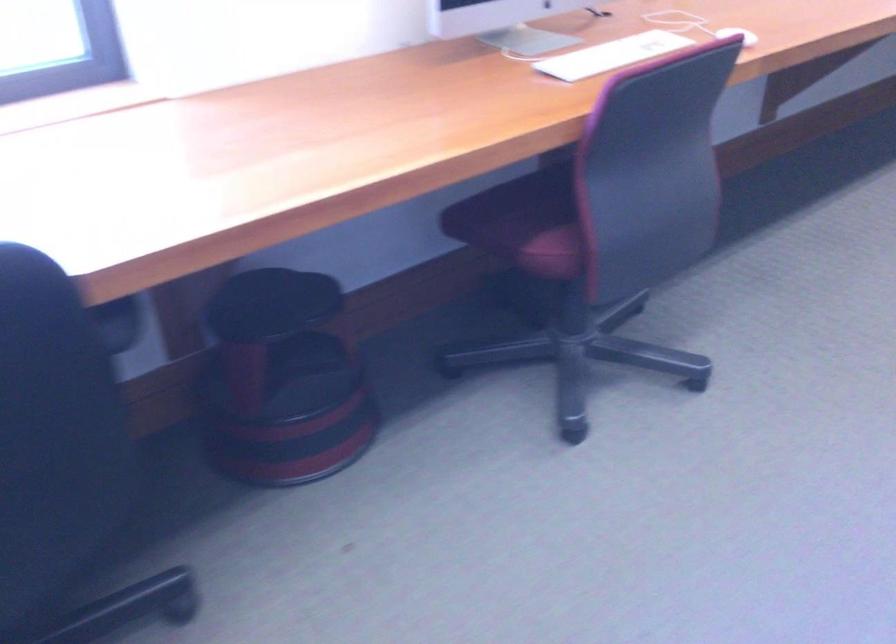
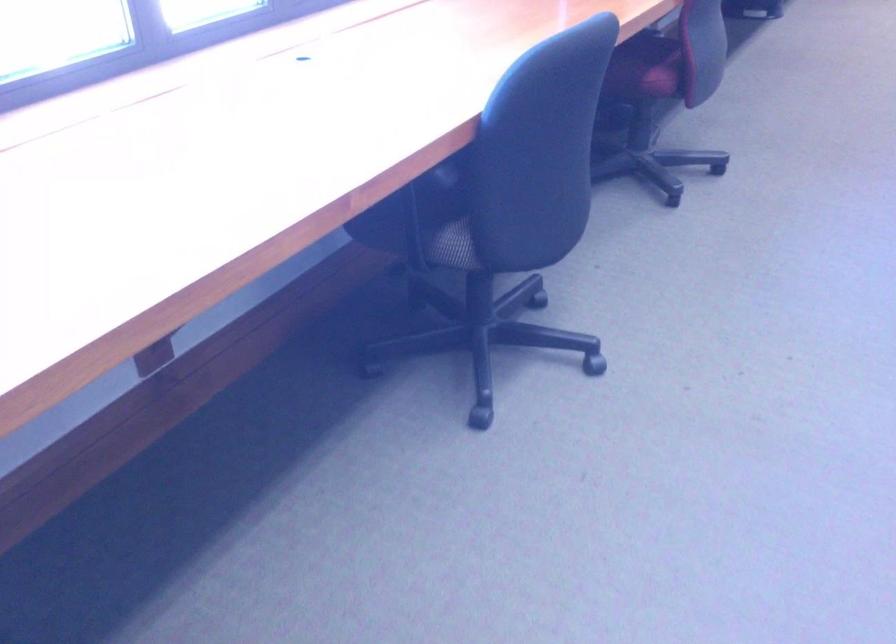
In a continuous first-person perspective shot, in which direction is the camera moving?

The cameraman moved toward left, backward.